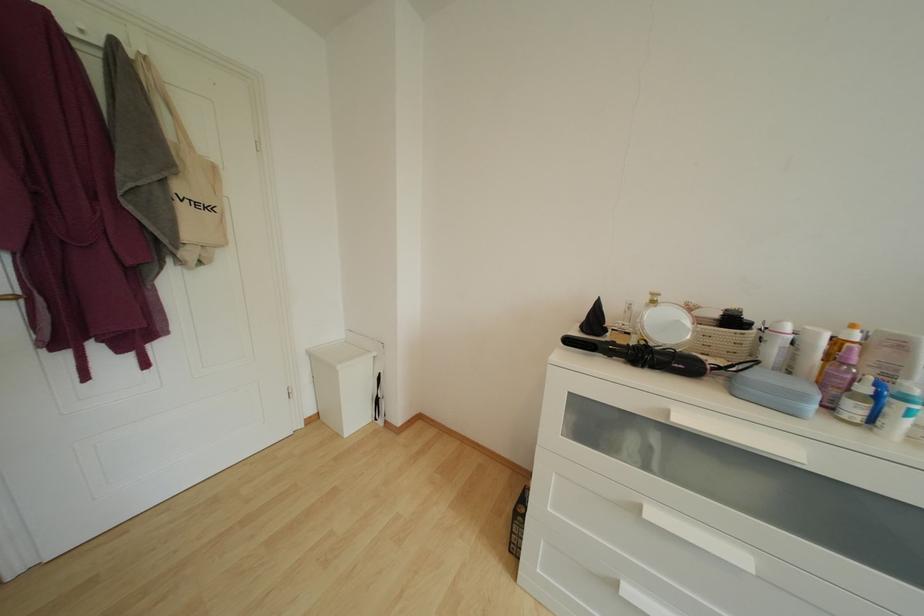
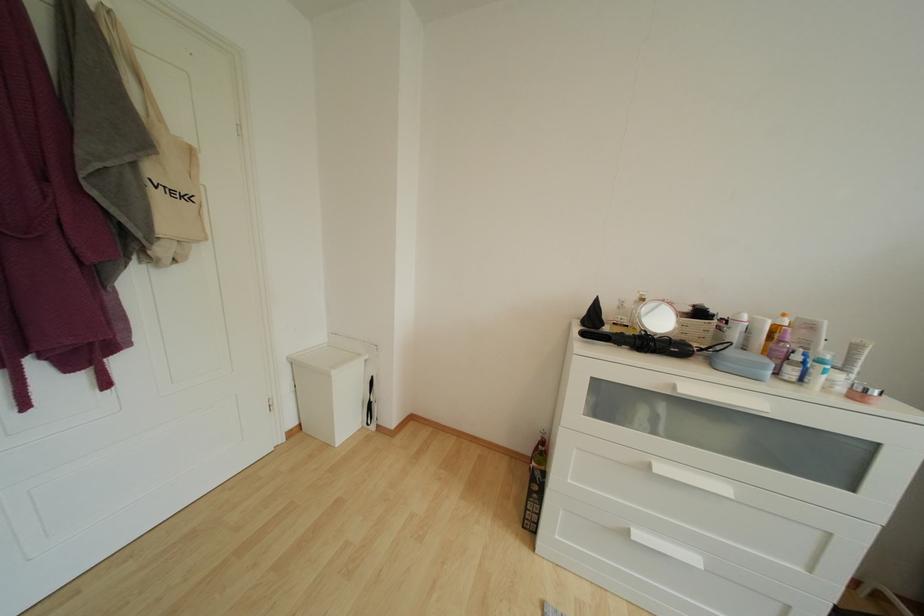
Question: What movement of the cameraman would produce the second image?

Choices:
 (A) Left
 (B) Right
 (C) Forward
 (D) Backward

Answer: (A)